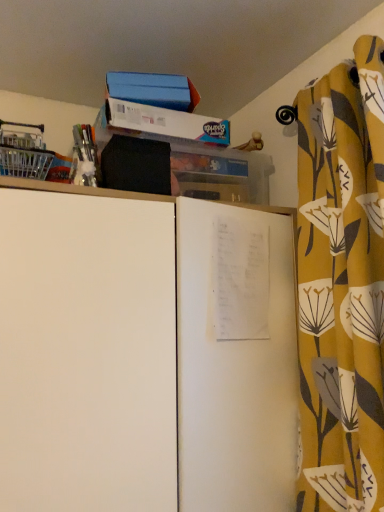
Find the location of a particular element. white matte cabinet at center is located at coordinates (144, 353).

The height and width of the screenshot is (512, 384). What do you see at coordinates (144, 353) in the screenshot? I see `white matte cabinet at center` at bounding box center [144, 353].

This screenshot has height=512, width=384. Describe the element at coordinates (342, 285) in the screenshot. I see `yellow floral fabric curtain at right` at that location.

The width and height of the screenshot is (384, 512). What are the coordinates of `yellow floral fabric curtain at right` in the screenshot? It's located at (342, 285).

Measure the distance between yellow floral fabric curtain at right and camera.

yellow floral fabric curtain at right and camera are 81.83 centimeters apart.

Locate an element on the screen. white matte cabinet at center is located at coordinates (144, 353).

Which object is positioned more to the right, white matte cabinet at center or yellow floral fabric curtain at right?

From the viewer's perspective, yellow floral fabric curtain at right appears more on the right side.

Is the position of white matte cabinet at center more distant than that of yellow floral fabric curtain at right?

No, it is not.

Which is closer, (x=250, y=394) or (x=379, y=408)?

Point (x=250, y=394).

From the image's perspective, is white matte cabinet at center located above or below yellow floral fabric curtain at right?

Based on their image positions, white matte cabinet at center is located beneath yellow floral fabric curtain at right.

From a real-world perspective, is white matte cabinet at center below yellow floral fabric curtain at right?

Yes, from a real-world perspective, white matte cabinet at center is beneath yellow floral fabric curtain at right.

Which of these two, white matte cabinet at center or yellow floral fabric curtain at right, is wider?

white matte cabinet at center is wider.

Is white matte cabinet at center taller or shorter than yellow floral fabric curtain at right?

white matte cabinet at center is shorter than yellow floral fabric curtain at right.

Considering the sizes of objects white matte cabinet at center and yellow floral fabric curtain at right in the image provided, who is smaller, white matte cabinet at center or yellow floral fabric curtain at right?

yellow floral fabric curtain at right.

Is white matte cabinet at center completely or partially outside of yellow floral fabric curtain at right?

Yes.

Is white matte cabinet at center next to yellow floral fabric curtain at right and touching it?

white matte cabinet at center and yellow floral fabric curtain at right are not in contact.

Is white matte cabinet at center oriented towards yellow floral fabric curtain at right?

Yes, white matte cabinet at center is facing yellow floral fabric curtain at right.

How many degrees apart are the facing directions of white matte cabinet at center and yellow floral fabric curtain at right?

The angle between the facing direction of white matte cabinet at center and the facing direction of yellow floral fabric curtain at right is 91.4 degrees.

Locate an element on the screen. curtain that is behind the white matte cabinet at center is located at coordinates (342, 285).

In the scene shown: Can you confirm if yellow floral fabric curtain at right is positioned to the left of white matte cabinet at center?

Incorrect, yellow floral fabric curtain at right is not on the left side of white matte cabinet at center.

Between yellow floral fabric curtain at right and white matte cabinet at center, which one is positioned behind?

yellow floral fabric curtain at right is behind.

Considering the positions of point (382, 110) and point (63, 209), is point (382, 110) closer or farther from the camera than point (63, 209)?

Point (382, 110) appears to be farther away from the viewer than point (63, 209).

From the image's perspective, between yellow floral fabric curtain at right and white matte cabinet at center, who is located below?

white matte cabinet at center, from the image's perspective.

From a real-world perspective, is yellow floral fabric curtain at right positioned over white matte cabinet at center based on gravity?

Indeed, from a real-world perspective, yellow floral fabric curtain at right stands above white matte cabinet at center.

Considering the sizes of objects yellow floral fabric curtain at right and white matte cabinet at center in the image provided, who is wider, yellow floral fabric curtain at right or white matte cabinet at center?

white matte cabinet at center is wider.

Does yellow floral fabric curtain at right have a lesser height compared to white matte cabinet at center?

Incorrect, the height of yellow floral fabric curtain at right does not fall short of that of white matte cabinet at center.

Who is bigger, yellow floral fabric curtain at right or white matte cabinet at center?

white matte cabinet at center.

Is yellow floral fabric curtain at right completely or partially outside of white matte cabinet at center?

Yes, yellow floral fabric curtain at right is outside of white matte cabinet at center.

Is yellow floral fabric curtain at right beside white matte cabinet at center?

No, yellow floral fabric curtain at right is not touching white matte cabinet at center.

In the scene shown: Does yellow floral fabric curtain at right turn towards white matte cabinet at center?

No, yellow floral fabric curtain at right is not aimed at white matte cabinet at center.

Can you tell me how much yellow floral fabric curtain at right and white matte cabinet at center differ in facing direction?

The angle between the facing direction of yellow floral fabric curtain at right and the facing direction of white matte cabinet at center is 91.4 degrees.

Identify the location of cupboard below the yellow floral fabric curtain at right (from a real-world perspective). This screenshot has width=384, height=512. (144, 353).

At what (x,y) coordinates should I click in order to perform the action: click on curtain behind the white matte cabinet at center. Please return your answer as a coordinate pair (x, y). This screenshot has height=512, width=384. Looking at the image, I should click on (342, 285).

What are the coordinates of `cupboard on the left of yellow floral fabric curtain at right` in the screenshot? It's located at (144, 353).